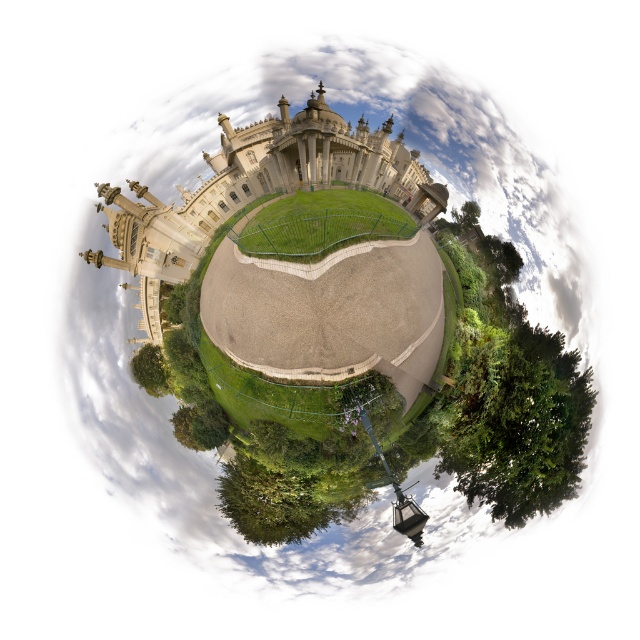
Question: Is green leafy tree at lower right wider than white stone amphitheater at center?

Choices:
 (A) no
 (B) yes

Answer: (A)

Question: Which of these objects is positioned farthest from the green leafy tree at center?

Choices:
 (A) white stone amphitheater at center
 (B) green leafy tree at lower right

Answer: (B)

Question: Which point is closer to the camera?

Choices:
 (A) (212, 157)
 (B) (150, 368)
 (C) (472, 218)

Answer: (A)

Question: Where is white stone amphitheater at center located in relation to green leafy tree at center in the image?

Choices:
 (A) above
 (B) below

Answer: (A)

Question: Which object is the closest to the green leafy tree at lower right?

Choices:
 (A) white stone amphitheater at center
 (B) green leafy tree at center

Answer: (A)

Question: Considering the relative positions of white stone amphitheater at center and green leafy tree at center in the image provided, where is white stone amphitheater at center located with respect to green leafy tree at center?

Choices:
 (A) left
 (B) right

Answer: (B)